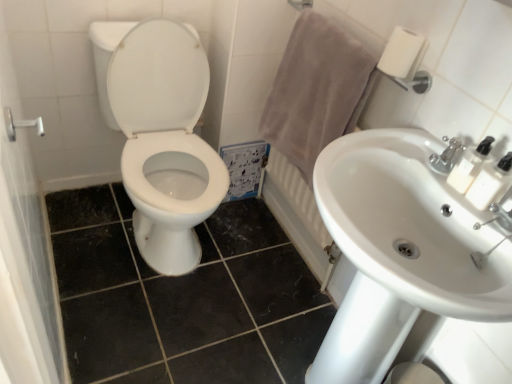
You are a GUI agent. You are given a task and a screenshot of the screen. Output one action in this format:
    pyautogui.click(x=<x>, y=<y>)
    Task: Click on the free area in between white glossy toilet at center and white ceramic radiator at upper right
    The image size is (512, 384).
    Given the screenshot: What is the action you would take?
    pyautogui.click(x=250, y=255)